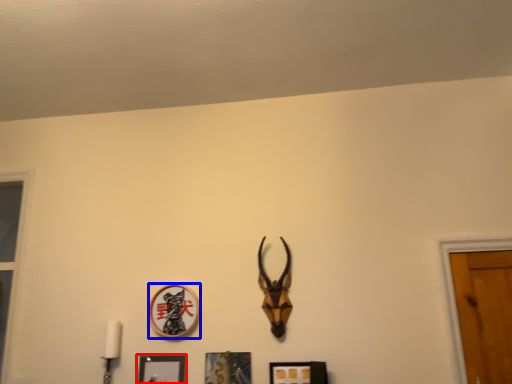
Question: Which object appears closest to the camera in this image, picture frame (highlighted by a red box) or picture frame (highlighted by a blue box)?

Choices:
 (A) picture frame
 (B) picture frame

Answer: (A)